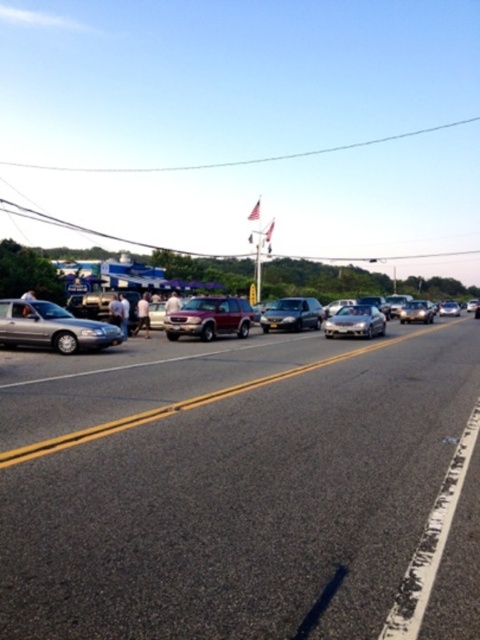
Question: Does silver metallic sedan at left have a lesser width compared to satin burgundy suv at center?

Choices:
 (A) no
 (B) yes

Answer: (B)

Question: Which of the following is the closest to the observer?

Choices:
 (A) (375, 320)
 (B) (278, 324)
 (C) (417, 310)

Answer: (A)

Question: Which object appears closest to the camera in this image?

Choices:
 (A) satin burgundy suv at center
 (B) satin silver sedan at center
 (C) satin silver suv at center

Answer: (A)

Question: Which is nearer to the satin silver sedan at center?

Choices:
 (A) satin silver suv at center
 (B) satin silver car at center

Answer: (A)

Question: Does silver metallic sedan at left appear over satin burgundy suv at center?

Choices:
 (A) yes
 (B) no

Answer: (B)

Question: Does silver metallic sedan at left appear on the right side of satin silver car at center?

Choices:
 (A) no
 (B) yes

Answer: (A)